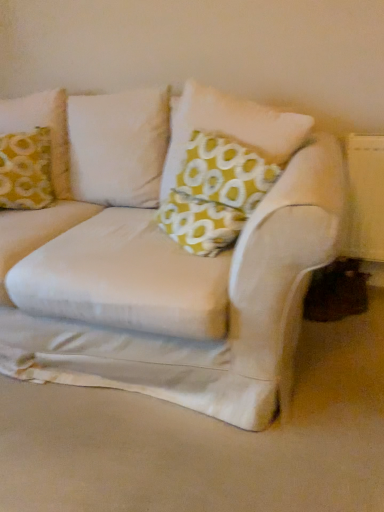
Question: From the image's perspective, is yellow fabric pillow at upper left, marked as the 1th pillow in a left-to-right arrangement, positioned above or below yellow fabric pillow at center, the 2th pillow when ordered from left to right?

Choices:
 (A) below
 (B) above

Answer: (B)

Question: From their relative heights in the image, would you say yellow fabric pillow at upper left, the second pillow positioned from the right, is taller or shorter than yellow fabric pillow at center, the 2th pillow when ordered from left to right?

Choices:
 (A) tall
 (B) short

Answer: (B)

Question: Does point (18, 105) appear closer or farther from the camera than point (185, 182)?

Choices:
 (A) closer
 (B) farther

Answer: (B)

Question: From a real-world perspective, is yellow fabric pillow at center, the 2th pillow when ordered from left to right, physically located above or below yellow fabric pillow at upper left, the second pillow positioned from the right?

Choices:
 (A) above
 (B) below

Answer: (A)

Question: Looking at their shapes, would you say yellow fabric pillow at center, the 2th pillow when ordered from left to right, is wider or thinner than yellow fabric pillow at upper left, marked as the 1th pillow in a left-to-right arrangement?

Choices:
 (A) thin
 (B) wide

Answer: (A)

Question: From the image's perspective, is yellow fabric pillow at center, which is counted as the 1th pillow, starting from the right, positioned above or below yellow fabric pillow at upper left, the second pillow positioned from the right?

Choices:
 (A) below
 (B) above

Answer: (A)

Question: From their relative heights in the image, would you say yellow fabric pillow at center, the 2th pillow when ordered from left to right, is taller or shorter than yellow fabric pillow at upper left, marked as the 1th pillow in a left-to-right arrangement?

Choices:
 (A) short
 (B) tall

Answer: (B)